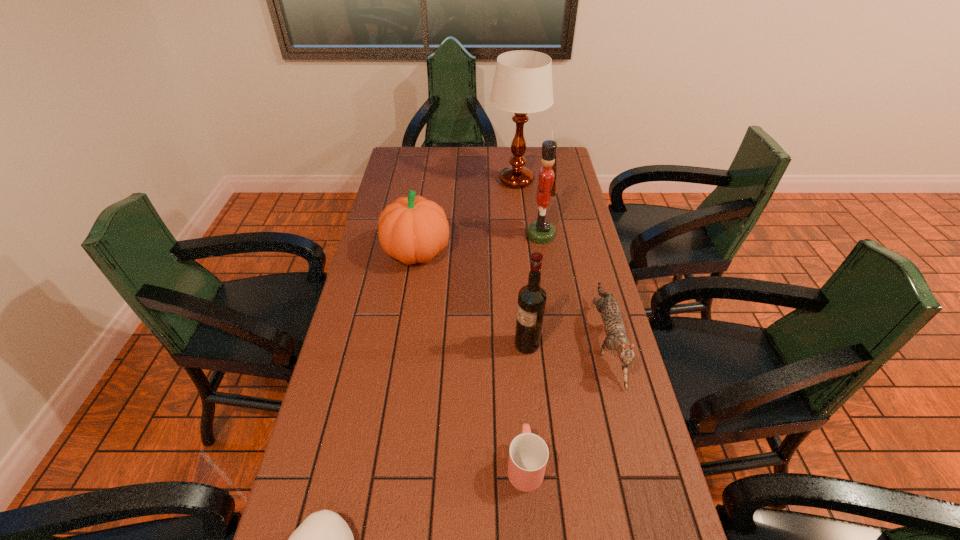
You are a GUI agent. You are given a task and a screenshot of the screen. Output one action in this format:
    pyautogui.click(x=<x>, y=<y>)
    Task: Click on the farthest object
    
    Given the screenshot: What is the action you would take?
    pyautogui.click(x=522, y=84)

Find the location of a particular element. This screenshot has height=540, width=960. the tallest object is located at coordinates (522, 84).

Locate an element on the screen. This screenshot has width=960, height=540. nutcracker is located at coordinates (542, 232).

The height and width of the screenshot is (540, 960). I want to click on the third tallest object, so click(x=532, y=297).

Image resolution: width=960 pixels, height=540 pixels. Identify the location of the fourth tallest object. (412, 229).

Find the location of a particular element. the fifth tallest object is located at coordinates (617, 339).

This screenshot has height=540, width=960. I want to click on the rightmost object, so click(617, 339).

The width and height of the screenshot is (960, 540). I want to click on cup, so click(528, 455).

Find the location of a particular element. free spot located on the back of the tallest object is located at coordinates (514, 158).

I want to click on free space located on the front-facing side of the nutcracker, so click(439, 235).